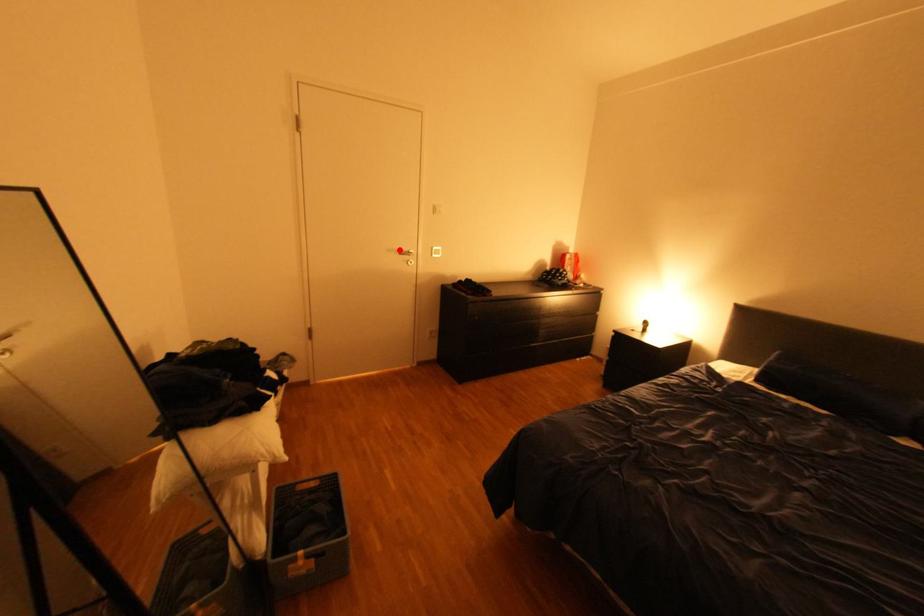
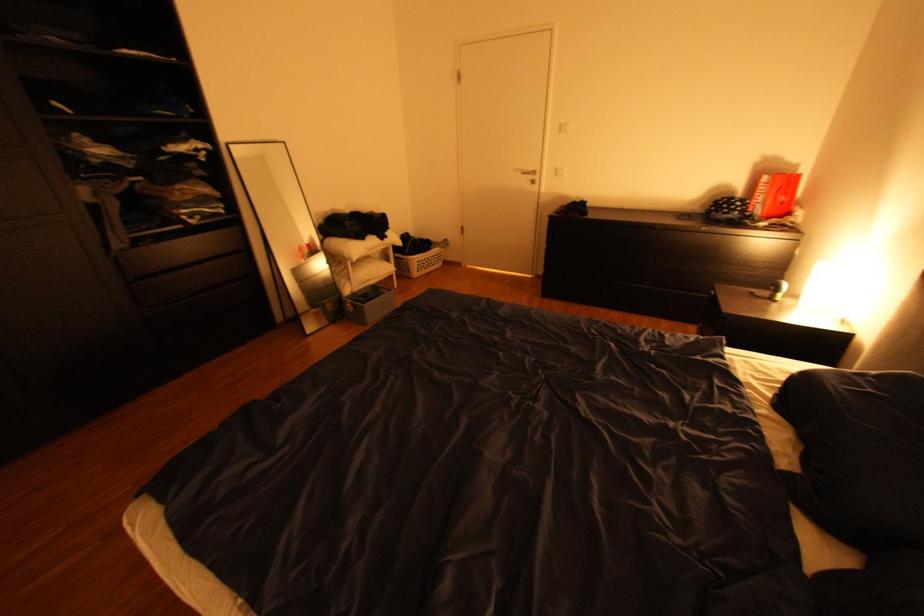
The point at the highlighted location is marked in the first image. Where is the corresponding point in the second image?

(526, 171)